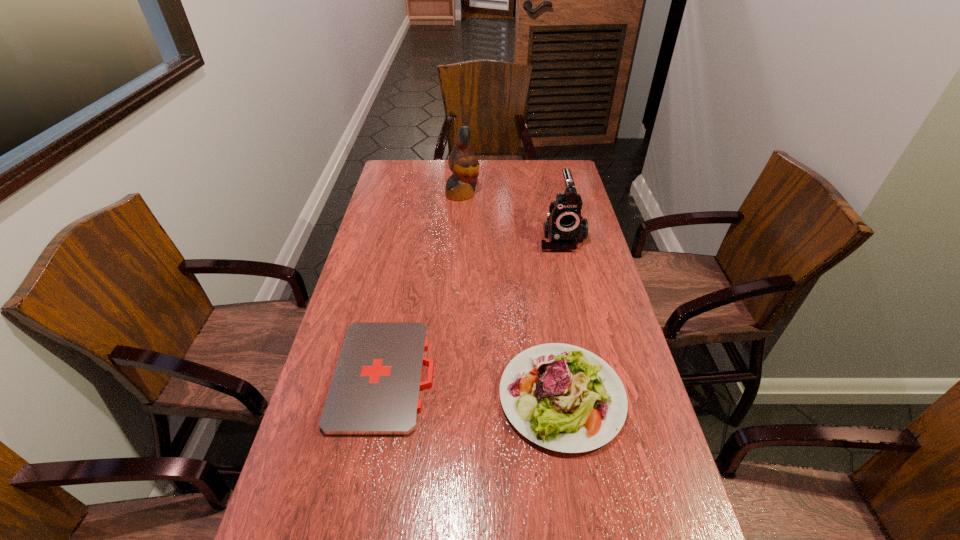
I want to click on object situated at the far edge, so click(x=463, y=163).

Image resolution: width=960 pixels, height=540 pixels. Identify the location of object located at the left edge. click(375, 390).

Find the location of a particular element. The image size is (960, 540). camcorder present at the right edge is located at coordinates (565, 227).

What are the coordinates of `salad plate that is at the right edge` in the screenshot? It's located at (562, 397).

In the image, there is a desktop. Where is `vacant region at the far edge`? The image size is (960, 540). vacant region at the far edge is located at coordinates (484, 176).

The height and width of the screenshot is (540, 960). What are the coordinates of `vacant point at the left edge` in the screenshot? It's located at (369, 257).

Identify the location of free location at the right edge. (577, 276).

Where is `vacant space at the far right corner`? The image size is (960, 540). vacant space at the far right corner is located at coordinates (556, 180).

I want to click on free space between the second shortest object and the first-aid kit, so click(473, 386).

Locate an element on the screen. vacant space in between the parrot and the third tallest object is located at coordinates (512, 295).